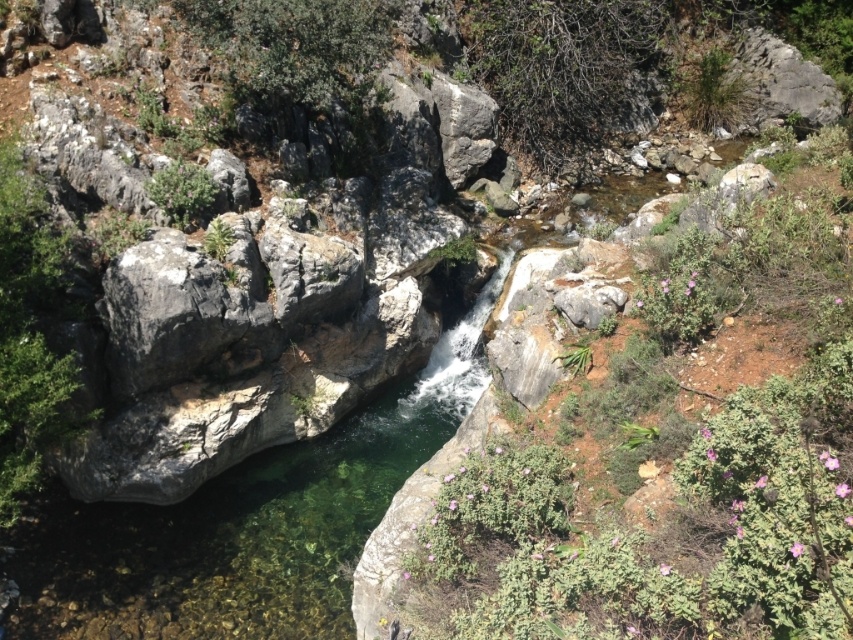
Question: Does green leafy shrubs at center appear over gray rough rock at center?

Choices:
 (A) no
 (B) yes

Answer: (A)

Question: Is green leafy bush at upper center behind green leafy shrub at left?

Choices:
 (A) no
 (B) yes

Answer: (B)

Question: Which object is the farthest from the green leafy bush at upper left?

Choices:
 (A) green leafy shrub at left
 (B) gray rough rock at center

Answer: (A)

Question: Which is farther from the green leafy shrubs at center?

Choices:
 (A) green leafy bush at upper left
 (B) green leafy shrub at left
 (C) gray rough rock at center

Answer: (A)

Question: Which object appears closest to the camera in this image?

Choices:
 (A) gray rough rock at center
 (B) green leafy bush at upper center
 (C) green leafy shrub at left
 (D) green leafy shrubs at center

Answer: (D)

Question: Is green leafy bush at upper center thinner than green leafy shrub at left?

Choices:
 (A) yes
 (B) no

Answer: (B)